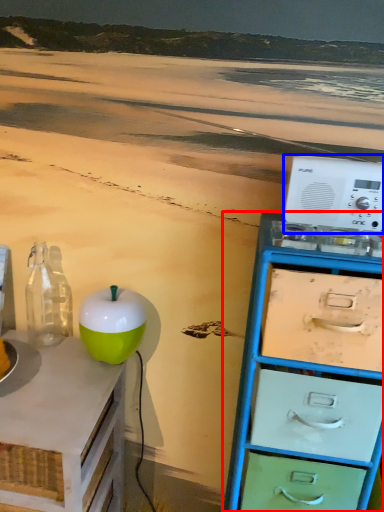
Question: Which object is closer to the camera taking this photo, chest of drawers (highlighted by a red box) or appliance (highlighted by a blue box)?

Choices:
 (A) chest of drawers
 (B) appliance

Answer: (A)